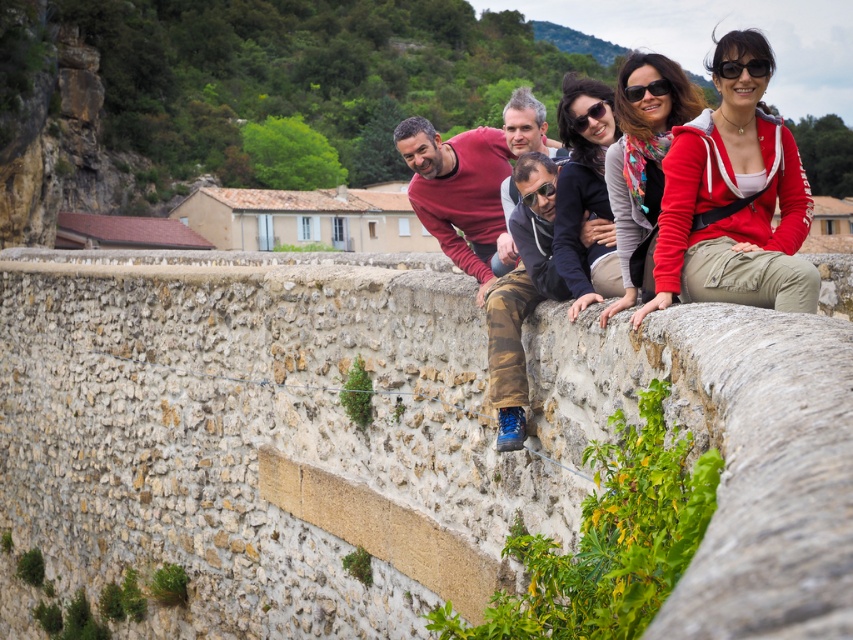
Question: Which object is farther from the camera taking this photo?

Choices:
 (A) red hoodie at center
 (B) black plastic sunglasses at upper right
 (C) black plastic goggles at center
 (D) matte black sunglasses at center

Answer: (D)

Question: Estimate the real-world distances between objects in this image. Which object is farther from the red hoodie at center?

Choices:
 (A) black plastic sunglasses at upper right
 (B) black plastic sunglasses at upper center
 (C) black plastic goggles at center

Answer: (C)

Question: Is black plastic goggles at center to the left of black plastic sunglasses at upper center from the viewer's perspective?

Choices:
 (A) no
 (B) yes

Answer: (B)

Question: Is red hoodie at center below black plastic sunglasses at upper center?

Choices:
 (A) no
 (B) yes

Answer: (B)

Question: Can you confirm if black plastic goggles at center is positioned below black plastic sunglasses at upper center?

Choices:
 (A) no
 (B) yes

Answer: (B)

Question: Which object is closer to the camera taking this photo?

Choices:
 (A) matte black sunglasses at center
 (B) red hoodie at center
 (C) black plastic sunglasses at upper center
 (D) black plastic goggles at center

Answer: (B)